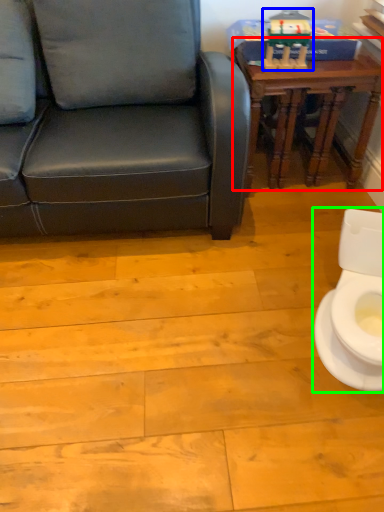
Question: Which object is the closest to the table (highlighted by a red box)? Choose among these: toy (highlighted by a blue box) or toilet (highlighted by a green box).

Choices:
 (A) toy
 (B) toilet

Answer: (A)